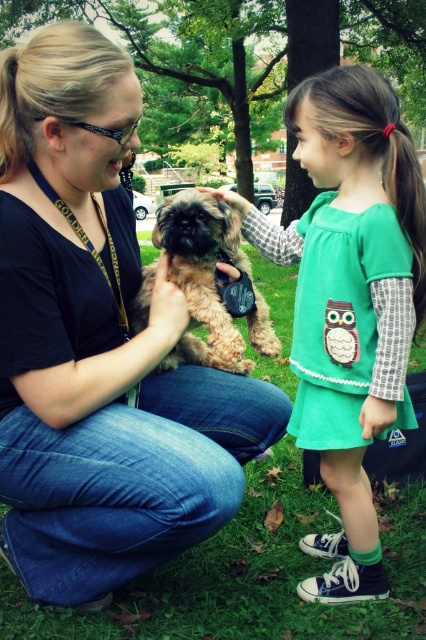
You are a photographer trying to capture a clear photo of both the matte black shirt at center and the green fabric dress at center. Since the camera can only focus on one object at a time, which object should you focus on to ensure the other is still in the frame?

The matte black shirt at center might be wider than green fabric dress at center, so focusing on the wider object, matte black shirt at center, would ensure the green fabric dress at center remains in the frame.

You are a photographer trying to capture the perfect shot of the green fabric dress at center and the fuzzy brown dog at center. Which object should you focus on first if you want to ensure both are in sharp focus?

The green fabric dress at center is positioned under the fuzzy brown dog at center, so focusing on the fuzzy brown dog at center first would help ensure both are in sharp focus since it is closer to the camera.

You are a photographer trying to capture a photo of the green fabric dress at center and the fuzzy brown dog at center. Which object should you focus on first if you want to include both in your frame without moving the camera?

The fuzzy brown dog at center should be focused on first since the green fabric dress at center is to the right of it, ensuring both are within the frame by starting with the dog and adjusting the camera angle slightly to the right to include the dress.